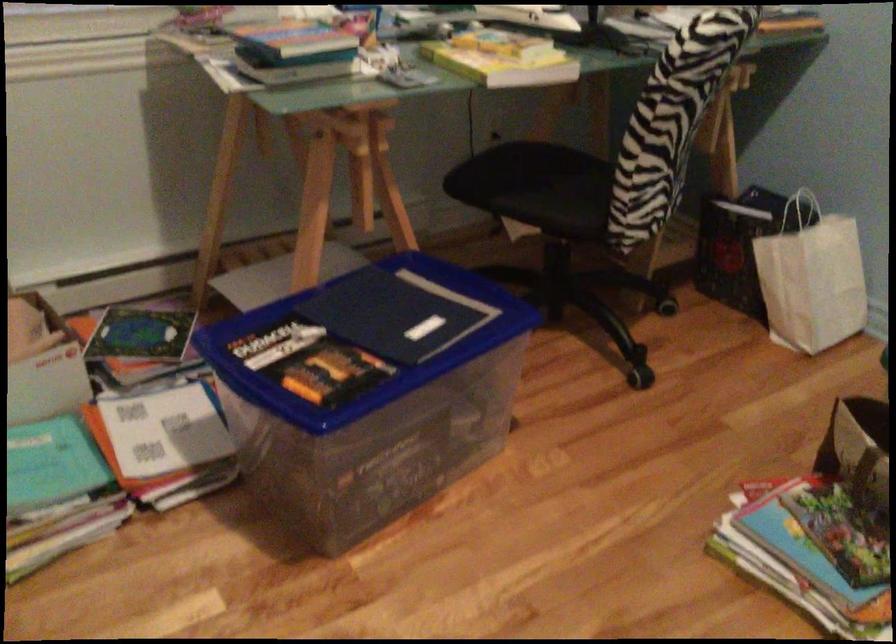
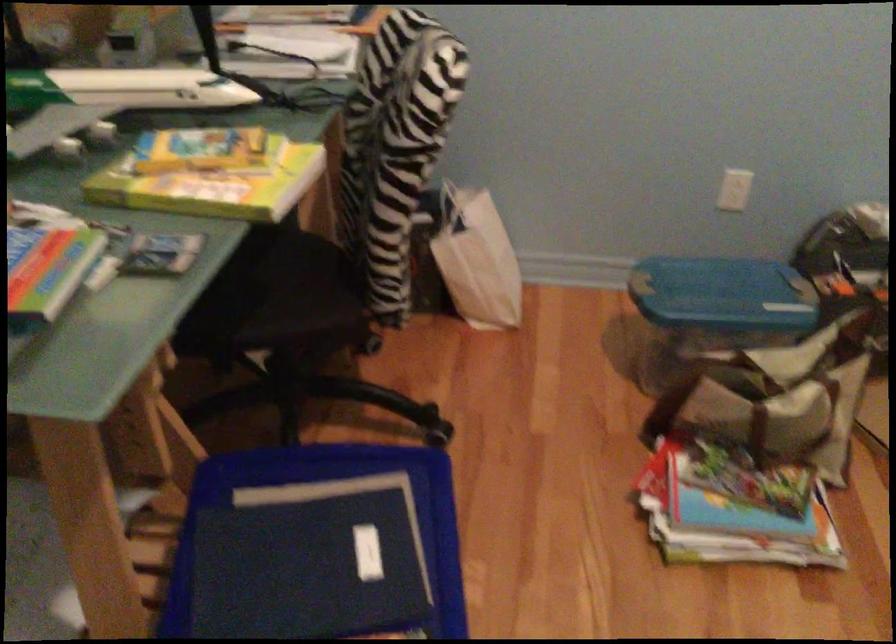
Question: How did the camera likely rotate?

Choices:
 (A) Left
 (B) Right
 (C) Up
 (D) Down

Answer: (B)